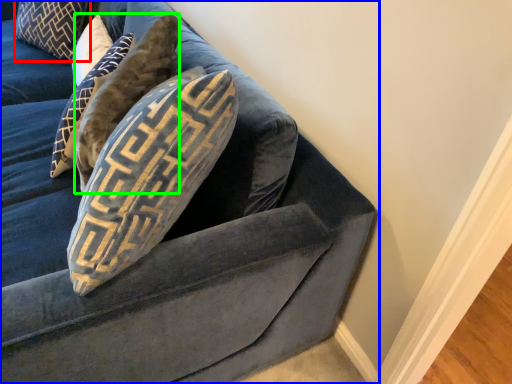
Question: Based on their relative distances, which object is farther from pillow (highlighted by a red box)? Choose from studio couch (highlighted by a blue box) and pillow (highlighted by a green box).

Choices:
 (A) studio couch
 (B) pillow

Answer: (A)